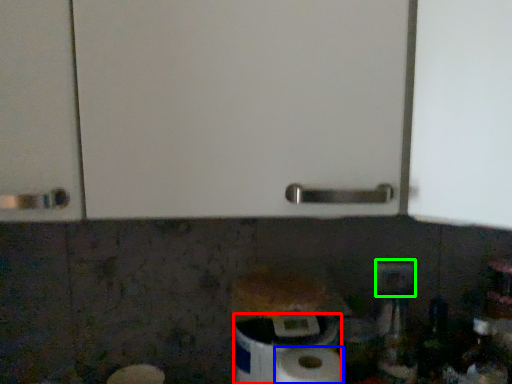
Question: Which is nearer to the toilet paper (highlighted by a red box)? paper towel (highlighted by a blue box) or electric outlet (highlighted by a green box).

Choices:
 (A) paper towel
 (B) electric outlet

Answer: (A)